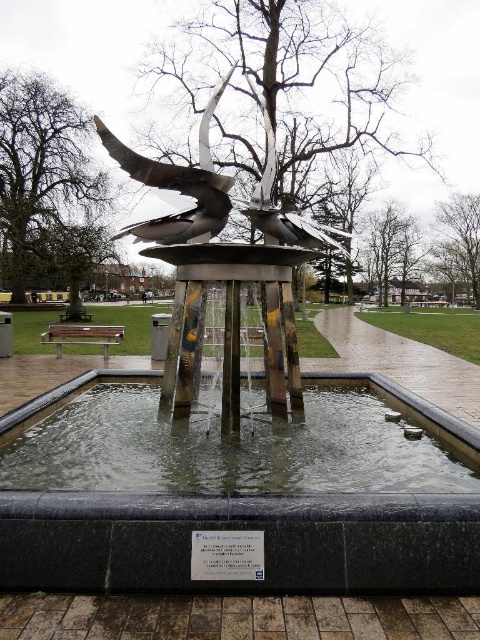
Question: Which point is farther to the camera?

Choices:
 (A) (269, 157)
 (B) (81, 321)

Answer: (B)

Question: Is metallic silver bird at upper center below metallic silver bench at lower left?

Choices:
 (A) no
 (B) yes

Answer: (A)

Question: Which of the following is the closest to the observer?

Choices:
 (A) (166, 221)
 (B) (175, 481)

Answer: (B)

Question: Does polished silver bird at center lie in front of metallic silver bird at upper center?

Choices:
 (A) no
 (B) yes

Answer: (B)

Question: Is polished stainless steel sculpture at center to the left of wooden bench at center from the viewer's perspective?

Choices:
 (A) no
 (B) yes

Answer: (A)

Question: Estimate the real-world distances between objects in this image. Which object is farther from the polished stainless steel sculpture at center?

Choices:
 (A) metallic silver bird at upper center
 (B) metallic silver bench at lower left
 (C) polished silver bird at center

Answer: (B)